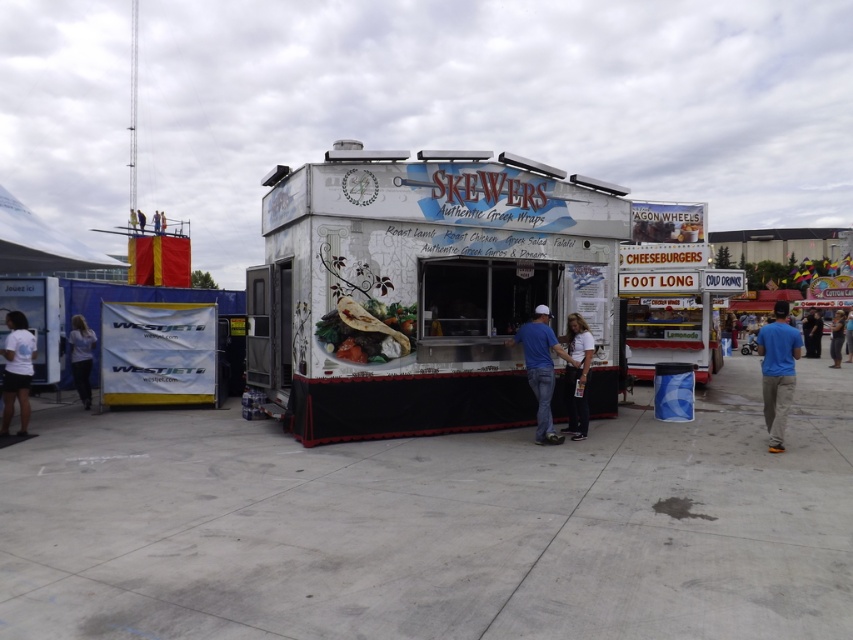
You are standing in front of the food truck named Skewers. There is a point at coordinates (392, 333). Can you tell me how far this point is from you in meters?

The point at (392, 333) is 8.97 meters away from you.

You are a customer standing at the food truck and see the blue jeans at left and the light brown fabric pants at lower right. How far apart are these two items?

The blue jeans at left and the light brown fabric pants at lower right are 22.09 meters apart.